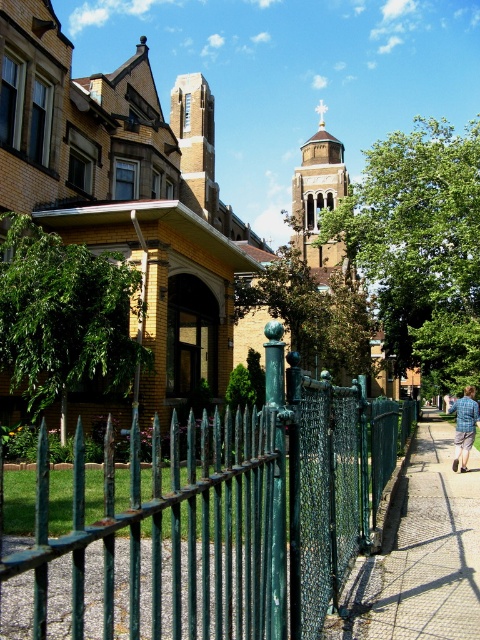
Looking at this image, you are a painter standing in the middle of the sidewalk. You need to paint both the green metal fence at center and the blue plaid shirt at right. Which object will require more paint due to its larger size?

The blue plaid shirt at right requires more paint because it occupies more space than the green metal fence at center.

From the picture: You are a delivery person with a 1.2 meter wide cart. You need to pass through the space between the green metal fence at center and the smooth concrete sidewalk at lower right. Can your cart fit through the space?

The green metal fence at center is thinner than the smooth concrete sidewalk at lower right, but the exact width of the space isn t provided. Without knowing the actual width of the space, it s impossible to determine if the cart will fit.

Based on the photo, you are standing on the smooth concrete sidewalk at lower right and want to greet the person wearing the blue plaid shirt at right. In which direction should you walk to reach them?

You should walk to the right because the blue plaid shirt at right is to the right of the smooth concrete sidewalk at lower right.